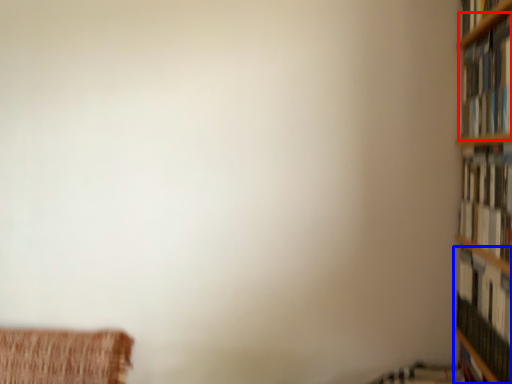
Question: Among these objects, which one is farthest to the camera, book (highlighted by a red box) or book (highlighted by a blue box)?

Choices:
 (A) book
 (B) book

Answer: (B)